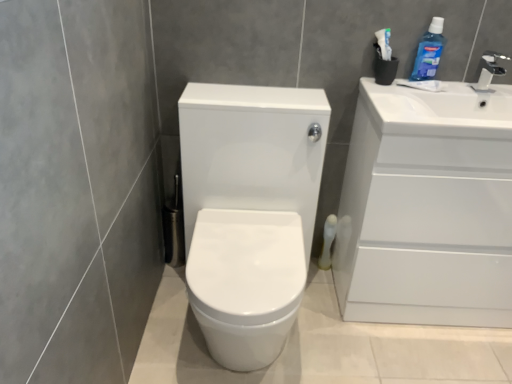
The width and height of the screenshot is (512, 384). I want to click on empty space that is to the right of blue glossy mouthwash at upper right, so click(x=462, y=82).